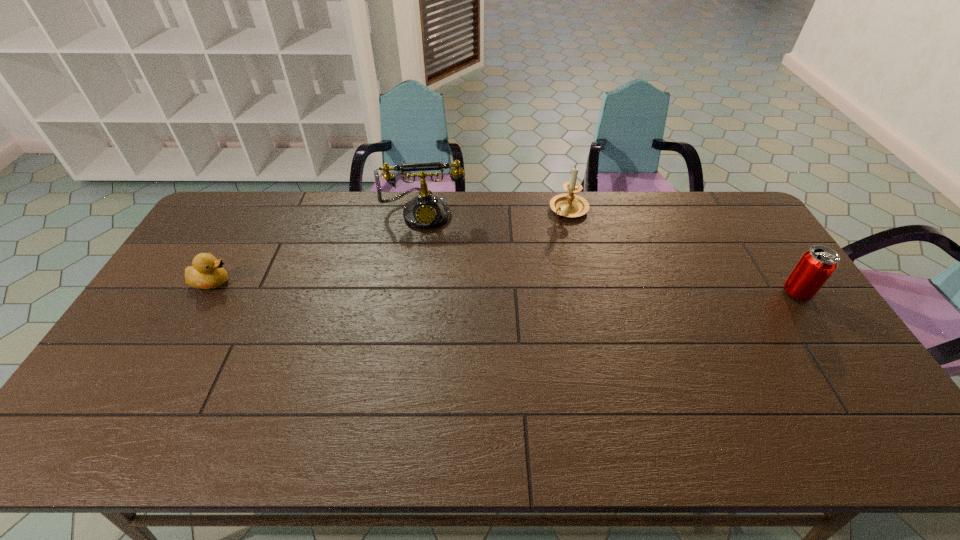
Locate an element on the screen. free space at the right edge of the desktop is located at coordinates (764, 296).

Where is `free location at the far right corner of the desktop`? This screenshot has width=960, height=540. free location at the far right corner of the desktop is located at coordinates (733, 218).

Find the location of a particular element. blank space at the near right corner of the desktop is located at coordinates (x=865, y=392).

At what (x,y) coordinates should I click in order to perform the action: click on free space between the telephone and the soda can. Please return your answer as a coordinate pair (x, y). The height and width of the screenshot is (540, 960). Looking at the image, I should click on (611, 252).

This screenshot has height=540, width=960. I want to click on unoccupied position between the third object from left to right and the third object from right to left, so click(496, 211).

What are the coordinates of `vacant space that is in between the rightmost object and the telephone` in the screenshot? It's located at (611, 252).

In order to click on free area in between the rightmost object and the leftmost object in this screenshot , I will do `click(505, 287)`.

What are the coordinates of `free space between the candle holder and the duckling` in the screenshot? It's located at (391, 246).

Find the location of a particular element. This screenshot has width=960, height=540. empty location between the telephone and the leftmost object is located at coordinates (319, 247).

Locate an element on the screen. free space between the leftmost object and the candle holder is located at coordinates (391, 246).